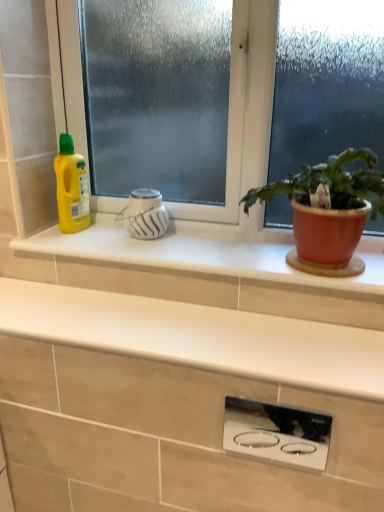
Question: Is polished stainless steel cooktop at center, acting as the 1th appliance starting from the front, taller or shorter than white glossy vase at center, acting as the 1th appliance starting from the top?

Choices:
 (A) tall
 (B) short

Answer: (A)

Question: Is point (235, 444) positioned closer to the camera than point (160, 218)?

Choices:
 (A) closer
 (B) farther

Answer: (A)

Question: Estimate the real-world distances between objects in this image. Which object is farther from the white glossy window sill at center?

Choices:
 (A) polished stainless steel cooktop at center, which is the 1th appliance in right-to-left order
 (B) matte terracotta pot at right
 (C) white glossy vase at center, the 2th appliance positioned from the right
 (D) yellow plastic bottle at left
 (E) white matte countertop at center

Answer: (A)

Question: Considering the real-world distances, which object is closest to the yellow plastic bottle at left?

Choices:
 (A) white matte countertop at center
 (B) white glossy vase at center, which ranks as the 2th appliance in bottom-to-top order
 (C) matte terracotta pot at right
 (D) frosted glass window at center
 (E) white glossy window sill at center

Answer: (B)